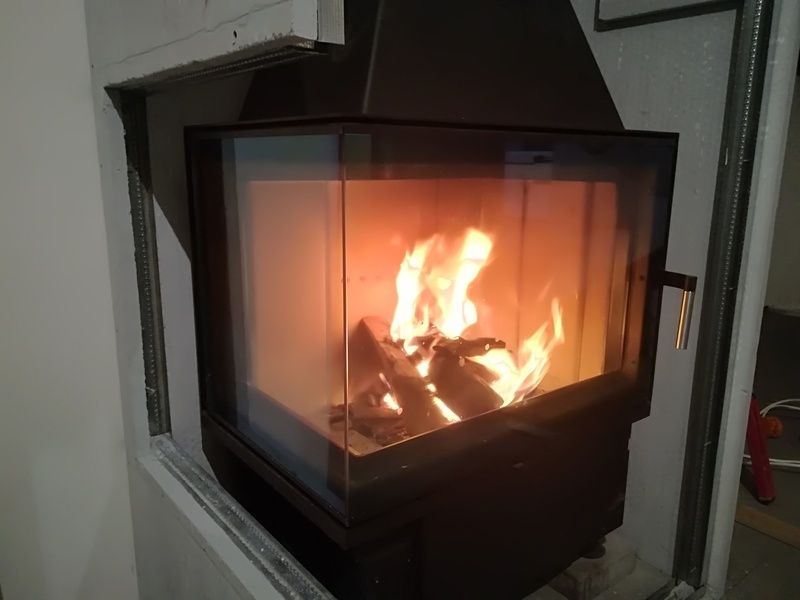
I want to click on wall, so click(x=37, y=314).